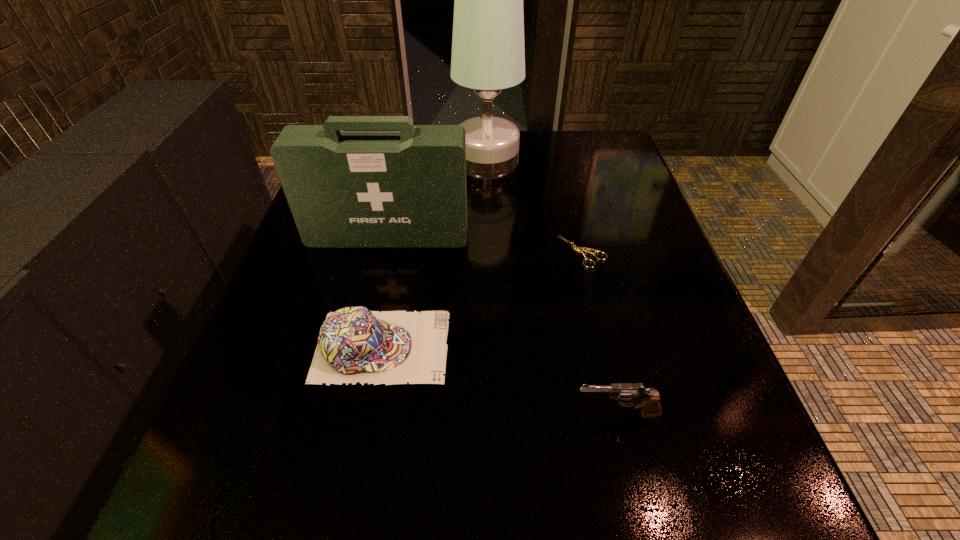
Locate an element on the screen. the tallest object is located at coordinates (488, 55).

Identify the location of the farthest object. (488, 55).

Where is `the second tallest object`? the second tallest object is located at coordinates (346, 189).

This screenshot has width=960, height=540. I want to click on the nearest object, so click(x=648, y=401).

In order to click on cap in this screenshot , I will do `click(355, 344)`.

You are a GUI agent. You are given a task and a screenshot of the screen. Output one action in this format:
    pyautogui.click(x=<x>, y=<y>)
    Task: Click on the shears
    
    Given the screenshot: What is the action you would take?
    pyautogui.click(x=578, y=249)

This screenshot has width=960, height=540. Identify the location of vacant area situated on the base of the tallest object. (348, 147).

Find the location of a particular element. vacant space situated 0.110m on the base of the tallest object is located at coordinates tap(412, 147).

Where is `vacant space situated 0.230m on the base of the tallest object`? This screenshot has width=960, height=540. vacant space situated 0.230m on the base of the tallest object is located at coordinates (367, 147).

What are the coordinates of `vacant space positioned 0.150m on the front-facing side of the first-aid kit` in the screenshot? It's located at (372, 303).